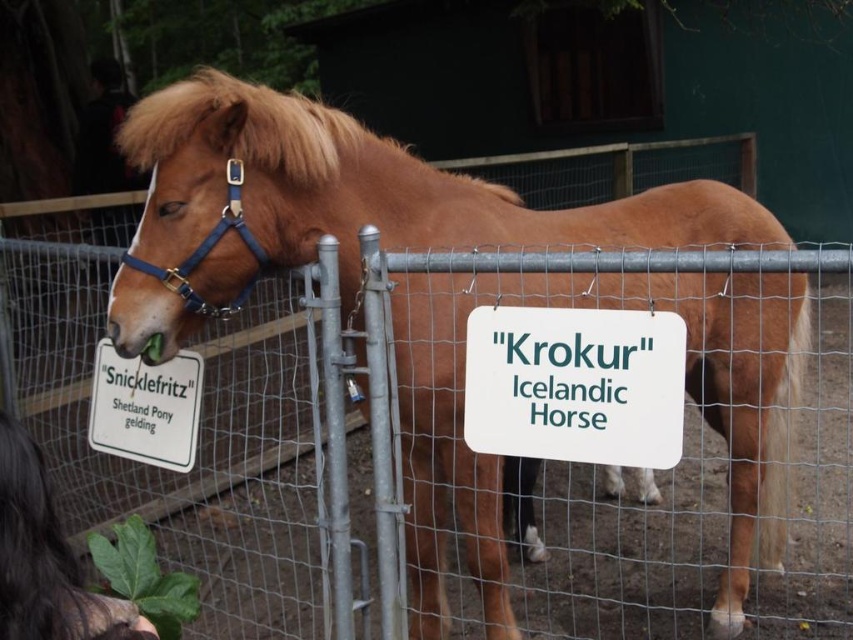
You are a zookeeper trying to read the sign about the brown glossy icelandic horse at center. Can you see the white plastic sign at center from your current position in front of the horse?

The white plastic sign at center is behind the brown glossy icelandic horse at center, so you cannot see it from in front of the horse.

From the picture: You are a visitor at a farm and see the brown glossy icelandic horse at center and the white plastic sign at left. Which object is taller?

The brown glossy icelandic horse at center is taller than the white plastic sign at left.